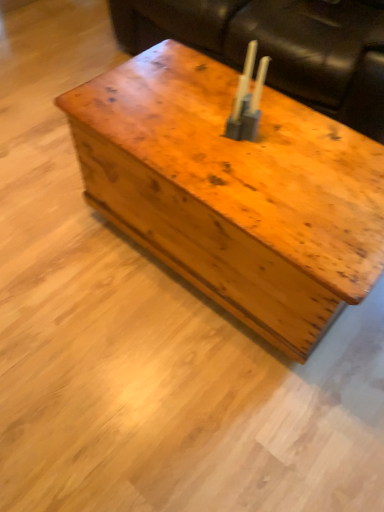
The height and width of the screenshot is (512, 384). I want to click on vacant space in front of metallic silver candle holder at center, so click(243, 176).